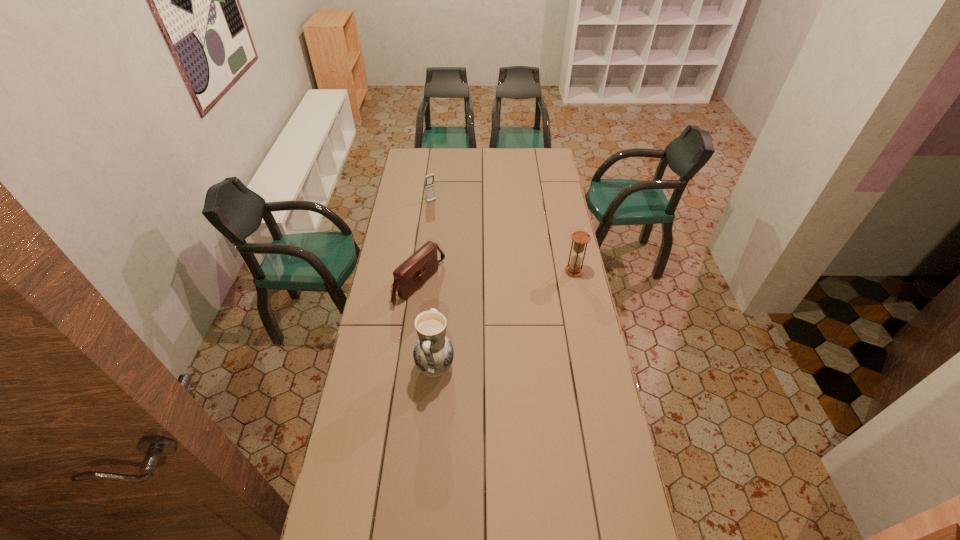
Identify the location of vacant space located 0.230m on the front flap of the shoulder bag. Image resolution: width=960 pixels, height=540 pixels. (483, 321).

At what (x,y) coordinates should I click in order to perform the action: click on vacant area situated on the front flap of the shoulder bag. Please return your answer as a coordinate pair (x, y). The image size is (960, 540). Looking at the image, I should click on (501, 330).

In order to click on blank space located 0.290m on the front flap of the shoulder bag in this screenshot , I will do `click(495, 327)`.

The width and height of the screenshot is (960, 540). Identify the location of free spot located on the front-facing side of the farthest object. (462, 235).

Locate an element on the screen. vacant point located on the front-facing side of the farthest object is located at coordinates (439, 210).

Where is `vacant space located 0.090m on the front-facing side of the farthest object`? The image size is (960, 540). vacant space located 0.090m on the front-facing side of the farthest object is located at coordinates click(x=442, y=212).

You are a GUI agent. You are given a task and a screenshot of the screen. Output one action in this format:
    pyautogui.click(x=<x>, y=<y>)
    Task: Click on the object that is at the left edge
    
    Given the screenshot: What is the action you would take?
    pyautogui.click(x=418, y=268)

I want to click on object located in the right edge section of the desktop, so click(580, 238).

Locate an element on the screen. This screenshot has width=960, height=540. free spot at the far edge of the desktop is located at coordinates (485, 158).

Find the location of `free location at the left edge`. free location at the left edge is located at coordinates (412, 192).